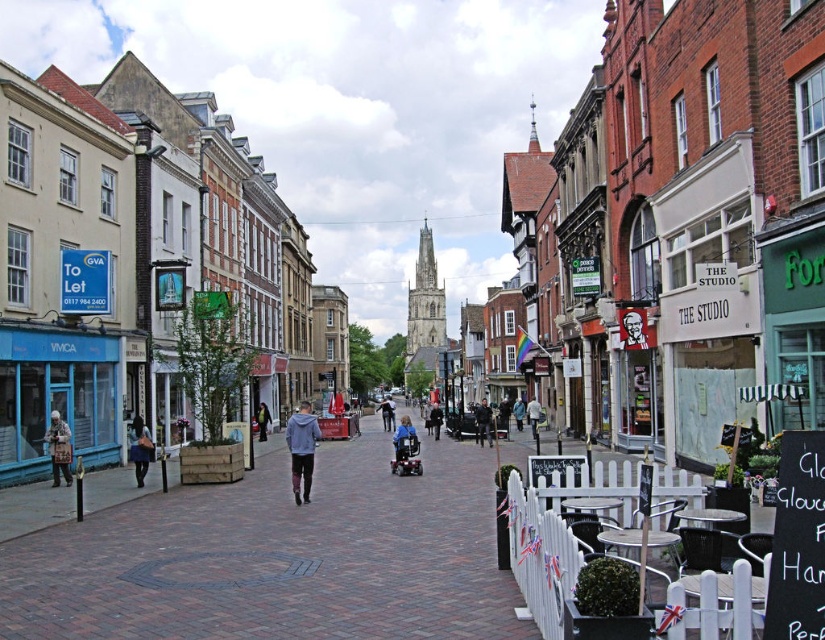
You are a passerby on the street and see a patterned coat at left and dark blue jeans at center. Which item is positioned to the left of the other?

The patterned coat at left is positioned to the left of the dark blue jeans at center.

You are a photographer standing in the middle of the street. You want to capture both the dark blue jeans at center and the dark gray sweater at center in a single frame. Which object should you focus on to ensure both are in the frame without moving the camera?

The dark blue jeans at center has a lesser width compared to the dark gray sweater at center, so focusing on the dark blue jeans at center would allow both objects to fit within the frame since it takes up less space.